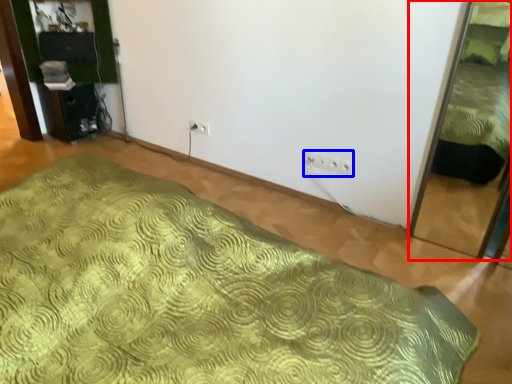
Question: Among these objects, which one is farthest to the camera, bed (highlighted by a red box) or electric outlet (highlighted by a blue box)?

Choices:
 (A) bed
 (B) electric outlet

Answer: (B)